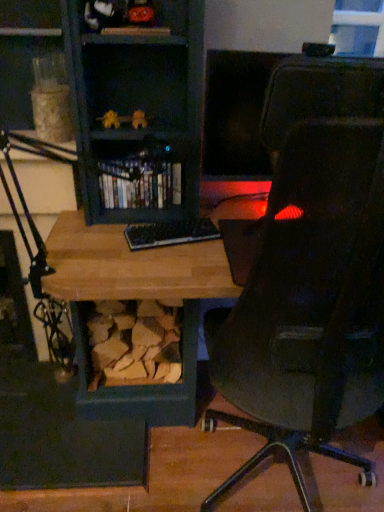
Question: From a real-world perspective, relative to shiny plastic books at center, is transparent glass window at upper right vertically above or below?

Choices:
 (A) below
 (B) above

Answer: (B)

Question: Looking at the image, does transparent glass window at upper right seem bigger or smaller compared to shiny plastic books at center?

Choices:
 (A) big
 (B) small

Answer: (B)

Question: Which object is positioned farthest from the black plastic keyboard at center?

Choices:
 (A) transparent glass window at upper right
 (B) shiny plastic books at center

Answer: (A)

Question: Which is nearer to the shiny plastic books at center?

Choices:
 (A) transparent glass window at upper right
 (B) black plastic keyboard at center

Answer: (B)